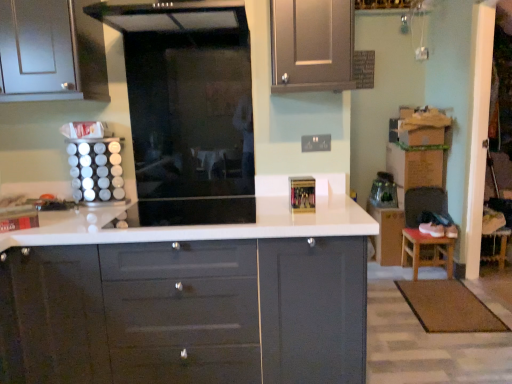
This screenshot has height=384, width=512. Identify the location of brown wooden stool at lower right. (426, 251).

The width and height of the screenshot is (512, 384). Describe the element at coordinates (96, 170) in the screenshot. I see `white glossy spice rack at left` at that location.

Where is `white glossy spice rack at left`? white glossy spice rack at left is located at coordinates (96, 170).

At what (x,y) coordinates should I click in order to perform the action: click on matte gray cabinet at upper center. Please return your answer as a coordinate pair (x, y). Looking at the image, I should click on (312, 45).

From the image's perspective, between white glossy countertop at center and brown wooden stool at lower right, which one is located above?

brown wooden stool at lower right.

In the image, is white glossy countertop at center on the left side or the right side of brown wooden stool at lower right?

white glossy countertop at center is positioned on brown wooden stool at lower right's left side.

Which is in front, point (243, 334) or point (445, 254)?

The point (243, 334) is more forward.

Measure the distance between brown wooden stool at lower right and white glossy countertop at center.

2.15 meters.

Is white glossy countertop at center inside brown wooden stool at lower right?

No, white glossy countertop at center is located outside of brown wooden stool at lower right.

Where is `countertop below the brown wooden stool at lower right (from the image's perspective)`? This screenshot has height=384, width=512. countertop below the brown wooden stool at lower right (from the image's perspective) is located at coordinates (193, 303).

Which of these two, brown wooden stool at lower right or white glossy countertop at center, is wider?

white glossy countertop at center.

Is white glossy spice rack at left taller or shorter than matte gray cabinet at upper center?

In the image, white glossy spice rack at left appears to be shorter than matte gray cabinet at upper center.

Does white glossy spice rack at left have a lesser width compared to matte gray cabinet at upper center?

Yes.

Are white glossy spice rack at left and matte gray cabinet at upper center making contact?

No, white glossy spice rack at left is not making contact with matte gray cabinet at upper center.

Is the surface of transparent glass door at center in direct contact with matte gray cabinet at upper center?

No, transparent glass door at center is not touching matte gray cabinet at upper center.

Would you say transparent glass door at center is outside matte gray cabinet at upper center?

Yes, transparent glass door at center is located beyond the bounds of matte gray cabinet at upper center.

Is transparent glass door at center oriented away from matte gray cabinet at upper center?

No, matte gray cabinet at upper center is not at the back of transparent glass door at center.

From their relative heights in the image, would you say transparent glass door at center is taller or shorter than white glossy countertop at center?

In the image, transparent glass door at center appears to be shorter than white glossy countertop at center.

Between transparent glass door at center and white glossy countertop at center, which one is positioned in front?

white glossy countertop at center is closer to the camera.

Between transparent glass door at center and white glossy countertop at center, which one has larger width?

white glossy countertop at center is wider.

From the image's perspective, is transparent glass door at center located above or below brown wooden stool at lower right?

Based on their image positions, transparent glass door at center is located above brown wooden stool at lower right.

Does point (148, 39) appear closer or farther from the camera than point (420, 250)?

Point (148, 39) is positioned closer to the camera compared to point (420, 250).

In the scene shown: Considering the relative positions of transparent glass door at center and brown wooden stool at lower right in the image provided, is transparent glass door at center in front of brown wooden stool at lower right?

That is True.

How different are the orientations of transparent glass door at center and brown wooden stool at lower right in degrees?

They differ by 3.19 degrees in their facing directions.

From the image's perspective, is white glossy spice rack at left under brown wooden stool at lower right?

No, from the image's perspective, white glossy spice rack at left is not below brown wooden stool at lower right.

Would you say white glossy spice rack at left is inside or outside brown wooden stool at lower right?

white glossy spice rack at left is outside brown wooden stool at lower right.

Which of these two, white glossy spice rack at left or brown wooden stool at lower right, stands shorter?

With less height is brown wooden stool at lower right.

Is white glossy spice rack at left next to brown wooden stool at lower right and touching it?

No, white glossy spice rack at left is not with brown wooden stool at lower right.

At what (x,y) coordinates should I click in order to perform the action: click on countertop below the brown wooden stool at lower right (from the image's perspective). Please return your answer as a coordinate pair (x, y). This screenshot has height=384, width=512. Looking at the image, I should click on [x=193, y=303].

Where is `countertop above the brown wooden stool at lower right (from a real-world perspective)`? The width and height of the screenshot is (512, 384). countertop above the brown wooden stool at lower right (from a real-world perspective) is located at coordinates (193, 303).

When comparing their distances from matte gray cabinet at upper center, does brown wooden stool at lower right or white glossy countertop at center seem closer?

The object closer to matte gray cabinet at upper center is white glossy countertop at center.

From the image, which object appears to be farther from matte gray cabinet at upper center, white glossy countertop at center or white glossy spice rack at left?

white glossy spice rack at left lies further to matte gray cabinet at upper center than the other object.

Based on their spatial positions, is transparent glass door at center or brown wooden stool at lower right closer to matte gray cabinet at upper center?

Among the two, transparent glass door at center is located nearer to matte gray cabinet at upper center.

Based on their spatial positions, is matte gray cabinet at upper center or white glossy spice rack at left closer to brown wooden stool at lower right?

The object closer to brown wooden stool at lower right is matte gray cabinet at upper center.

From the image, which object appears to be farther from white glossy countertop at center, transparent glass door at center or matte gray cabinet at upper center?

matte gray cabinet at upper center is further to white glossy countertop at center.

Looking at this image, estimate the real-world distances between objects in this image. Which object is closer to matte gray cabinet at upper center, brown wooden stool at lower right or white glossy spice rack at left?

white glossy spice rack at left.

From the image, which object appears to be nearer to matte gray cabinet at upper center, white glossy spice rack at left or transparent glass door at center?

transparent glass door at center lies closer to matte gray cabinet at upper center than the other object.

From the picture: Estimate the real-world distances between objects in this image. Which object is further from white glossy spice rack at left, brown wooden stool at lower right or matte gray cabinet at upper center?

brown wooden stool at lower right lies further to white glossy spice rack at left than the other object.

The width and height of the screenshot is (512, 384). In order to click on countertop situated between white glossy spice rack at left and brown wooden stool at lower right from left to right in this screenshot , I will do `click(193, 303)`.

The width and height of the screenshot is (512, 384). In order to click on cabinetry located between white glossy countertop at center and brown wooden stool at lower right in the depth direction in this screenshot , I will do `click(312, 45)`.

Identify the location of cabinetry located between white glossy spice rack at left and brown wooden stool at lower right in the left-right direction. (312, 45).

Where is `glass door between white glossy spice rack at left and matte gray cabinet at upper center from left to right`? The height and width of the screenshot is (384, 512). glass door between white glossy spice rack at left and matte gray cabinet at upper center from left to right is located at coordinates (192, 122).